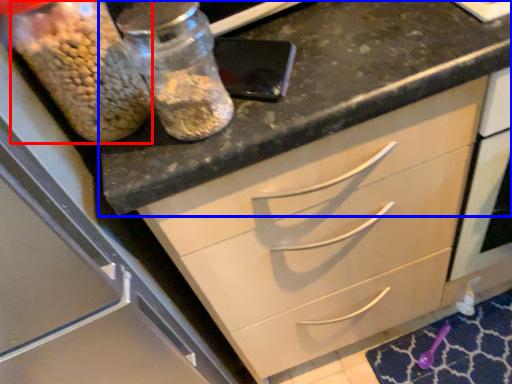
Question: Which point is closer to the camera, food (highlighted by a red box) or countertop (highlighted by a blue box)?

Choices:
 (A) food
 (B) countertop

Answer: (A)